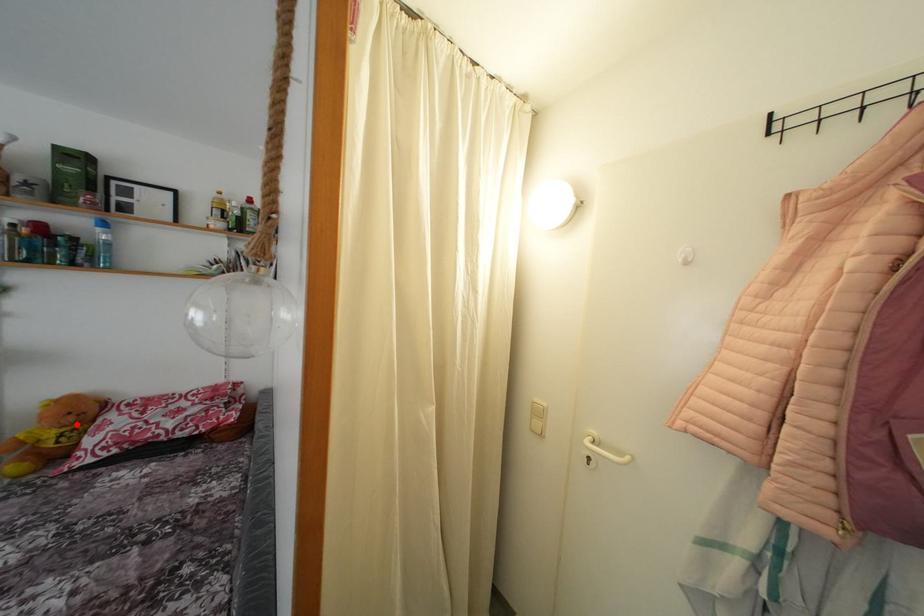
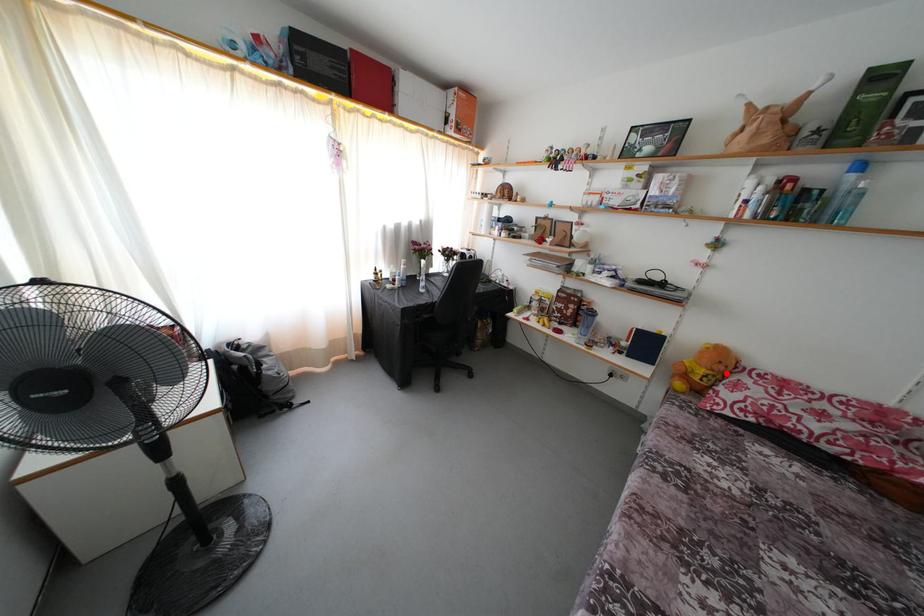
I am providing you with two images of the same scene from different viewpoints. A red point is marked on the first image and another point is marked on the second image. Are the points marked in image1 and image2 representing the same 3D position?

Yes